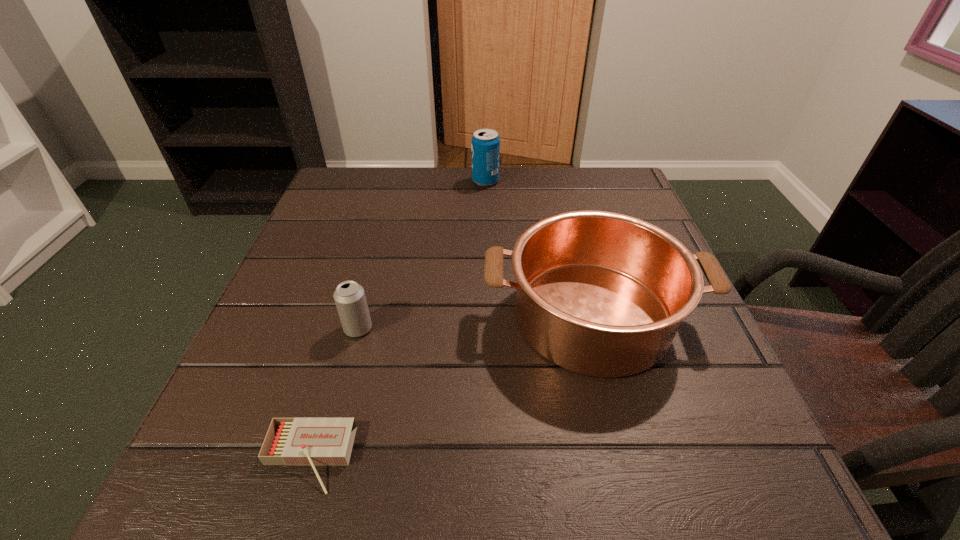
This screenshot has height=540, width=960. Identify the location of vacant space that is in between the beer can and the saucepan. (475, 322).

The height and width of the screenshot is (540, 960). I want to click on free space between the second shortest object and the soda can, so click(x=421, y=255).

Find the location of `vacant space in between the matchbox and the soda can`. vacant space in between the matchbox and the soda can is located at coordinates (396, 320).

Locate an element on the screen. This screenshot has height=540, width=960. free spot between the third tallest object and the shortest object is located at coordinates (333, 394).

The width and height of the screenshot is (960, 540). I want to click on free space between the saucepan and the third tallest object, so click(x=475, y=322).

The image size is (960, 540). I want to click on free space between the third tallest object and the soda can, so click(x=421, y=255).

Where is `vacant space that is in between the saucepan and the beer can`? vacant space that is in between the saucepan and the beer can is located at coordinates (475, 322).

Find the location of `vacant region between the saucepan and the nearest object`. vacant region between the saucepan and the nearest object is located at coordinates (450, 387).

Locate an element on the screen. This screenshot has width=960, height=540. empty space that is in between the saucepan and the beer can is located at coordinates coord(475,322).

This screenshot has width=960, height=540. Identify the location of object that is the third closest to the second shortest object. (485, 142).